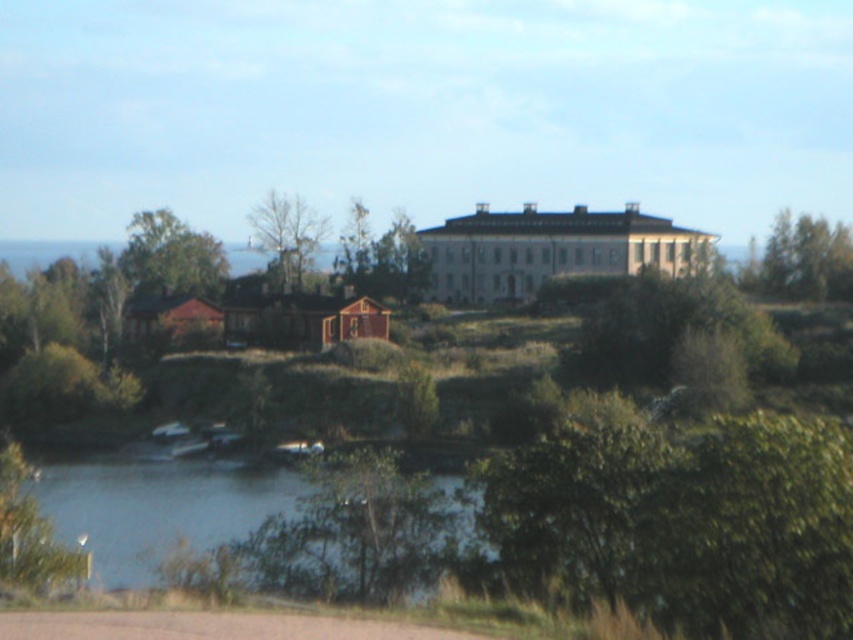
You are planning to plant a new tree in the garden. You have two options based on the image provided. The first is a green leafy tree at upper right, and the second is a green leafy tree at lower left. Which tree would you choose if you want a wider canopy for shade?

The green leafy tree at upper right might be wider than the green leafy tree at lower left, so it would provide a wider canopy for shade.